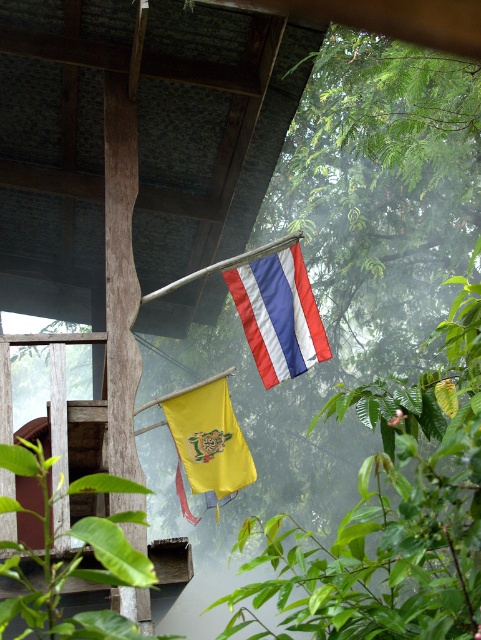
You are a photographer wanting to capture both the silky fabric flag at center and the yellow matte flag at upper center in a single frame. Which flag should you position your camera closer to in order to include both flags without zooming in?

You should position your camera closer to the yellow matte flag at upper center because the silky fabric flag at center is to the right of it, so by centering the camera between them, both can be captured without zooming in.

In the scene shown: You are a photographer standing 5 meters away from the wooden structure. You want to capture a clear photo of the silky fabric flag at center. Can you move closer to get a better shot without exceeding the maximum allowed distance of 7 meters from the flag?

The silky fabric flag at center is 8.40 meters away from the viewer. Since you are currently 5 meters away from the wooden structure, moving closer would only reduce your distance to the structure, not the flag. The maximum allowed distance is 7 meters from the flag, but you are already 8.40 meters away. Therefore, you cannot get closer to the flag within the allowed limit.